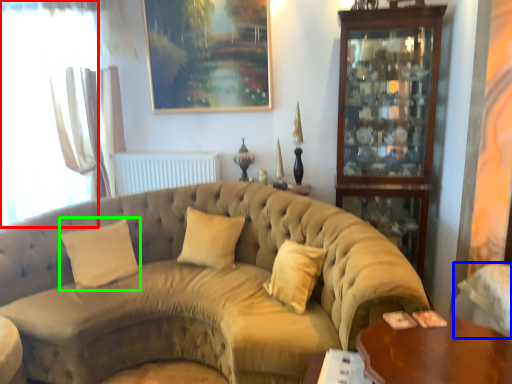
Question: Which object is the closest to the window (highlighted by a red box)? Choose among these: armchair (highlighted by a blue box) or pillow (highlighted by a green box).

Choices:
 (A) armchair
 (B) pillow

Answer: (B)